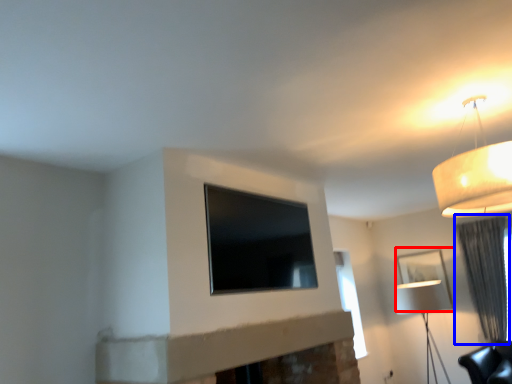
Question: Among these objects, which one is nearest to the camera, picture frame (highlighted by a red box) or curtain (highlighted by a blue box)?

Choices:
 (A) picture frame
 (B) curtain

Answer: (B)